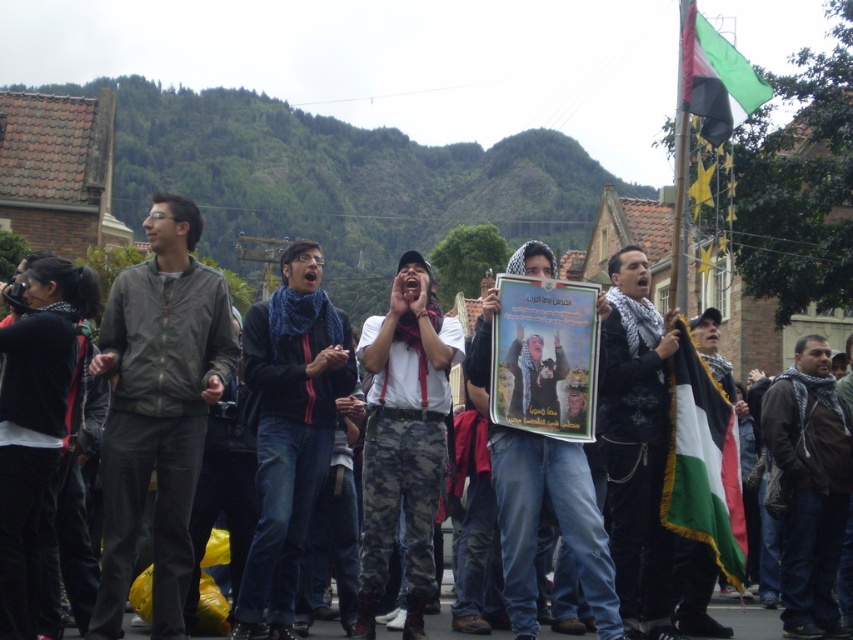
From the picture: Which is below, dark blue scarf at center or knitted scarf at center?

Positioned lower is knitted scarf at center.

Between dark blue scarf at center and knitted scarf at center, which one appears on the right side from the viewer's perspective?

Positioned to the right is knitted scarf at center.

Does point (263, 474) come behind point (809, 554)?

No, (263, 474) is in front of (809, 554).

Where is `dark blue scarf at center`? The image size is (853, 640). dark blue scarf at center is located at coordinates (289, 428).

Is point (172, 550) farther from camera compared to point (398, 260)?

That is False.

Is dark gray jacket at center positioned before camo pants at center?

Yes, dark gray jacket at center is in front of camo pants at center.

Between point (120, 596) and point (393, 349), which one is positioned behind?

Point (393, 349)

Identify the location of dark gray jacket at center. The image size is (853, 640). (158, 408).

Does camo pants at center appear over green and white fabric flag at center?

Correct, camo pants at center is located above green and white fabric flag at center.

Can you confirm if camo pants at center is positioned to the right of green and white fabric flag at center?

In fact, camo pants at center is to the left of green and white fabric flag at center.

Describe the element at coordinates (404, 438) in the screenshot. The image size is (853, 640). I see `camo pants at center` at that location.

Image resolution: width=853 pixels, height=640 pixels. Identify the location of camo pants at center. pyautogui.click(x=404, y=438).